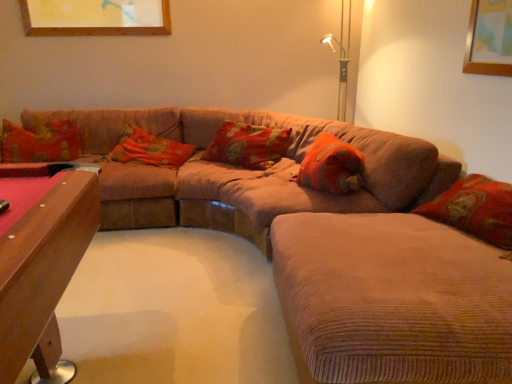
Question: Considering the positions of floral fabric pillow at center, which is the second pillow from left to right, and corduroy couch at lower right in the image, is floral fabric pillow at center, which is the second pillow from left to right, bigger or smaller than corduroy couch at lower right?

Choices:
 (A) big
 (B) small

Answer: (B)

Question: Would you say floral fabric pillow at center, which is the second pillow from left to right, is inside or outside corduroy couch at lower right?

Choices:
 (A) outside
 (B) inside

Answer: (A)

Question: Considering the real-world distances, which object is farthest from the fluffy orange pillow at center, the 1th pillow in the right-to-left sequence?

Choices:
 (A) corduroy textured pillow at center, which appears as the 2th pillow when viewed from the right
 (B) floral fabric pillow at center, which is the second pillow from left to right
 (C) floral fabric pillow at left, marked as the 4th pillow in a right-to-left arrangement
 (D) corduroy couch at lower right
 (E) corduroy couch at center

Answer: (C)

Question: Which is nearer to the corduroy couch at lower right?

Choices:
 (A) floral fabric pillow at left, the 1th pillow when ordered from left to right
 (B) fluffy orange pillow at center, the 1th pillow in the right-to-left sequence
 (C) corduroy textured pillow at center, which appears as the 2th pillow when viewed from the right
 (D) floral fabric pillow at center, which is the second pillow from left to right
 (E) corduroy couch at center

Answer: (E)